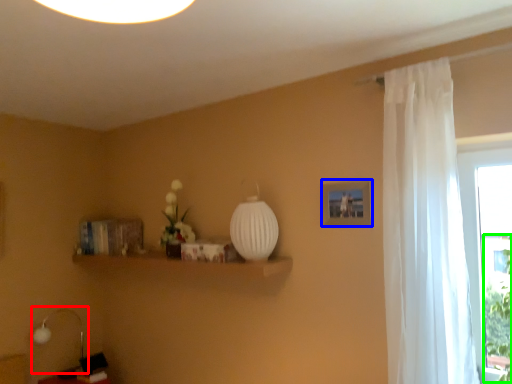
Question: Estimate the real-world distances between objects in this image. Which object is farther from table lamp (highlighted by a red box), picture frame (highlighted by a blue box) or plant (highlighted by a green box)?

Choices:
 (A) picture frame
 (B) plant

Answer: (B)